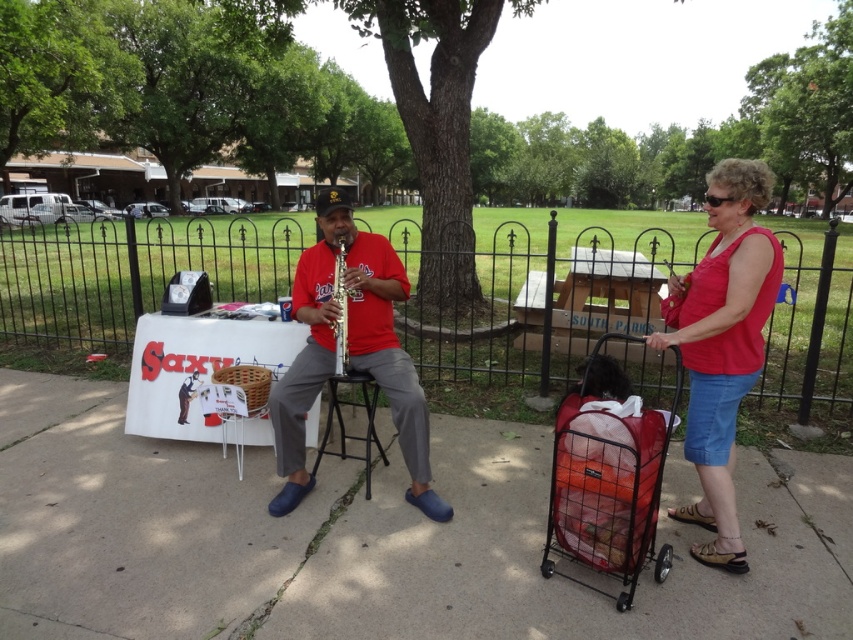
Does matte red tank top at right have a greater height compared to matte red shirt at center?

Yes, matte red tank top at right is taller than matte red shirt at center.

Can you confirm if matte red tank top at right is bigger than matte red shirt at center?

Indeed, matte red tank top at right has a larger size compared to matte red shirt at center.

Is point (730, 305) positioned before point (352, 276)?

Yes, point (730, 305) is closer to viewer.

Locate an element on the screen. matte red tank top at right is located at coordinates (723, 342).

Which is in front, point (726, 300) or point (343, 355)?

Point (726, 300) is more forward.

Which is in front, point (712, 445) or point (332, 298)?

Positioned in front is point (712, 445).

At what (x,y) coordinates should I click in order to perform the action: click on matte red tank top at right. Please return your answer as a coordinate pair (x, y). Image resolution: width=853 pixels, height=640 pixels. Looking at the image, I should click on (723, 342).

Based on the photo, between concrete sidewalk at center and matte red shirt at center, which one is positioned higher?

Positioned higher is matte red shirt at center.

Which of these two, concrete sidewalk at center or matte red shirt at center, stands taller?

matte red shirt at center is taller.

Who is more distant from viewer, (35, 381) or (305, 381)?

The point (35, 381) is behind.

This screenshot has height=640, width=853. What are the coordinates of `concrete sidewalk at center` in the screenshot? It's located at (364, 540).